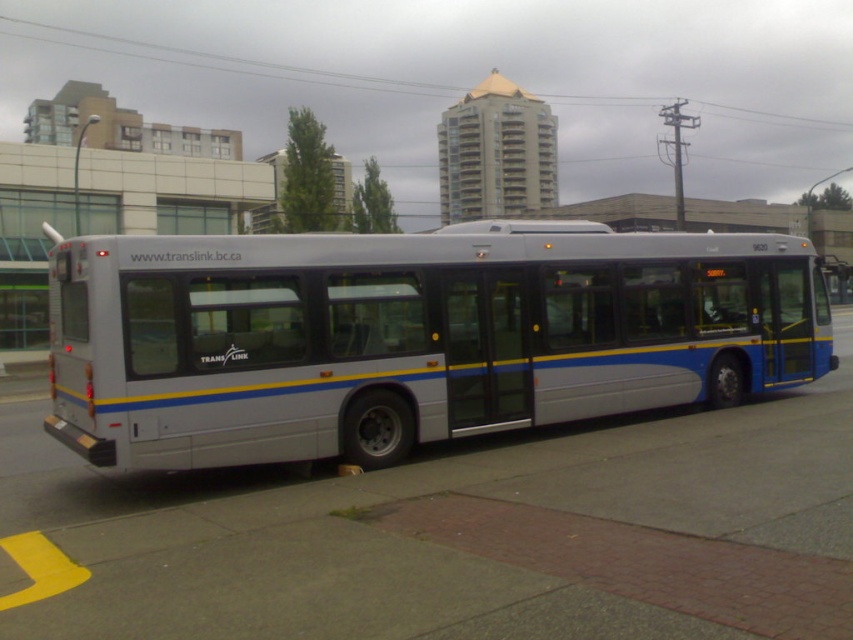
Between gray concrete pavement at center and silver metallic bus at center, which one is positioned higher?

Positioned higher is silver metallic bus at center.

Between gray concrete pavement at center and silver metallic bus at center, which one is positioned lower?

gray concrete pavement at center

This screenshot has height=640, width=853. What do you see at coordinates (456, 536) in the screenshot? I see `gray concrete pavement at center` at bounding box center [456, 536].

At what (x,y) coordinates should I click in order to perform the action: click on gray concrete pavement at center. Please return your answer as a coordinate pair (x, y). This screenshot has width=853, height=640. Looking at the image, I should click on (456, 536).